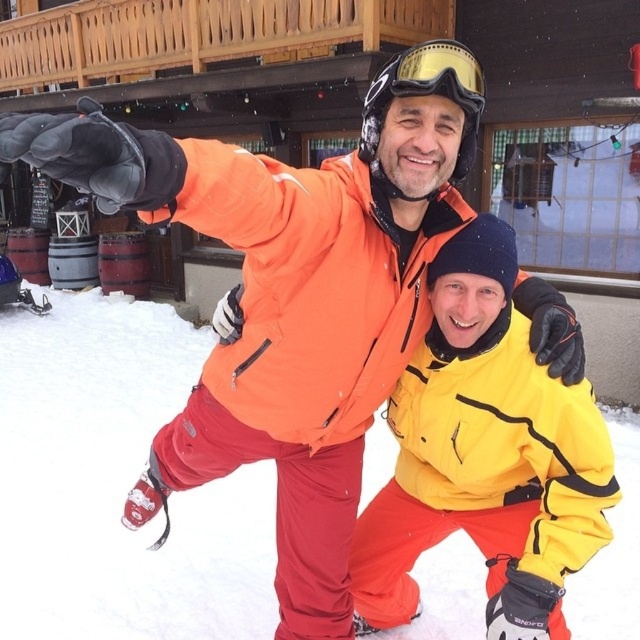
You are a drone operator trying to capture a photo of the two skiers. The drone is currently hovering at point coordinates of 0.5, 0.5. To get a clear shot of the white powder snow at center, should you move the drone north or south? Please explain your reasoning based on the coordinates provided.

The white powder snow at center is located at coordinates (116, 484). Since the drone is at (320, 320), it needs to move south to decrease the y coordinate from 0.5 to 0.183. Moving north would increase the y coordinate, which is the opposite direction. Therefore, move south.

You are standing at the origin point in the image. Which direction should you move to reach the yellow matte jacket at center?

The yellow matte jacket at center is located at coordinates 0.713 on the x and 0.759 on the y axis. To reach it, move towards the right and upward from the origin point.